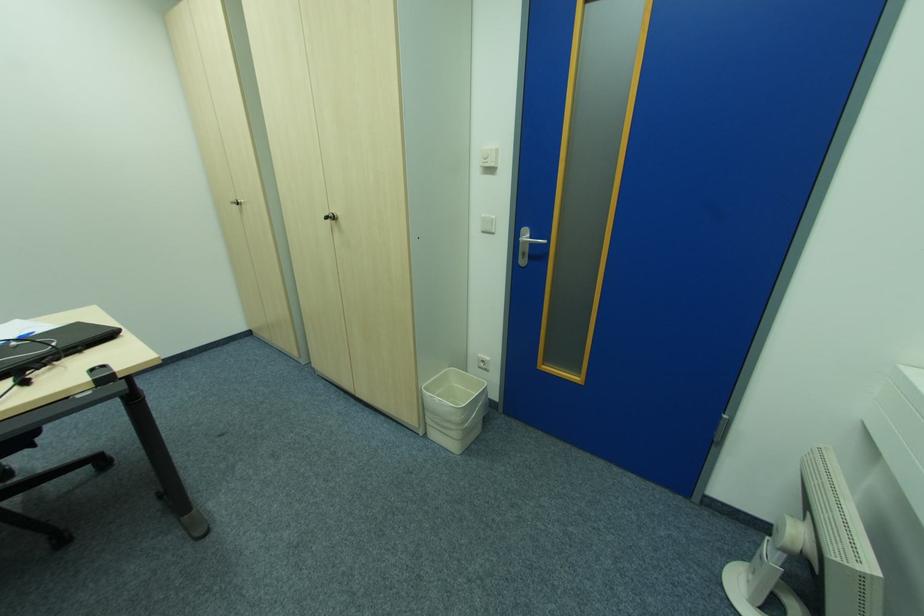
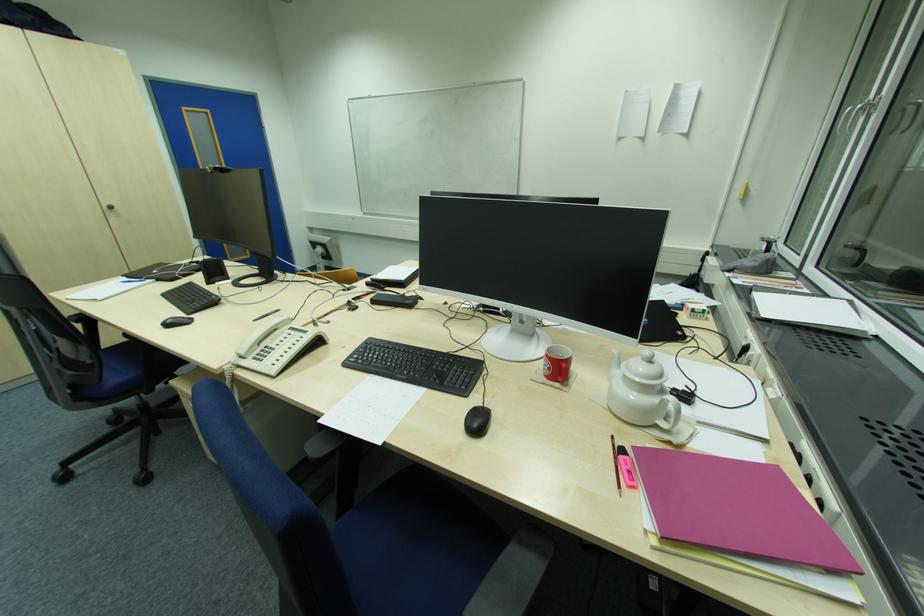
The point at (334,219) is marked in the first image. Where is the corresponding point in the second image?

(114, 209)